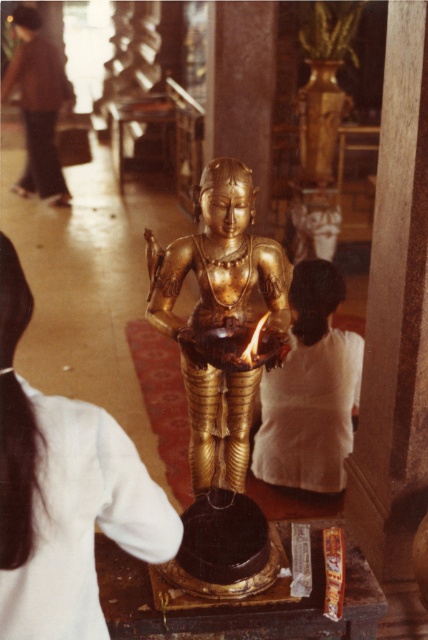
You are a visitor standing at the entrance of the temple. You see the gold polished statue at center and the dark brown fabric pants at upper left. Which object is closer to you?

The gold polished statue at center is closer to you because it is in front of the dark brown fabric pants at upper left.

You are an interior designer planning to rearrange the temple layout. You need to know which object takes up more space in the image. Which one is larger between the gold polished statue at center and the dark brown fabric pants at upper left?

The dark brown fabric pants at upper left takes up more space in the image than the gold polished statue at center, as the gold polished statue at center occupies less space than dark brown fabric pants at upper left.